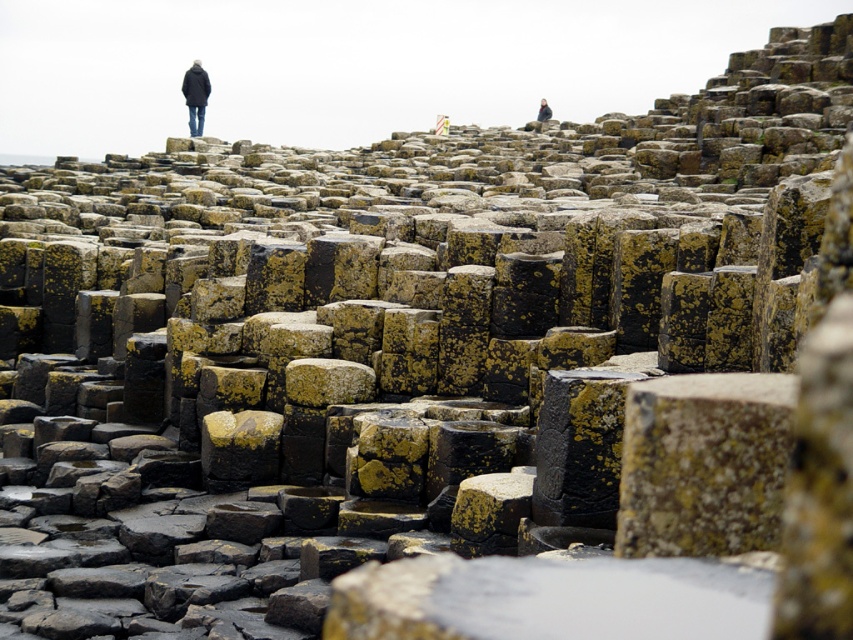
Question: Among these points, which one is nearest to the camera?

Choices:
 (A) (195, 61)
 (B) (544, 118)

Answer: (A)

Question: Is black matte coat at upper left positioned before dark gray jacket at upper center?

Choices:
 (A) yes
 (B) no

Answer: (A)

Question: Which point is farther to the camera?

Choices:
 (A) black matte coat at upper left
 (B) dark gray jacket at upper center

Answer: (B)

Question: Which point is closer to the camera?

Choices:
 (A) (543, 106)
 (B) (189, 108)

Answer: (B)

Question: Can you confirm if black matte coat at upper left is positioned below dark gray jacket at upper center?

Choices:
 (A) no
 (B) yes

Answer: (B)

Question: Considering the relative positions of black matte coat at upper left and dark gray jacket at upper center in the image provided, where is black matte coat at upper left located with respect to dark gray jacket at upper center?

Choices:
 (A) right
 (B) left

Answer: (B)